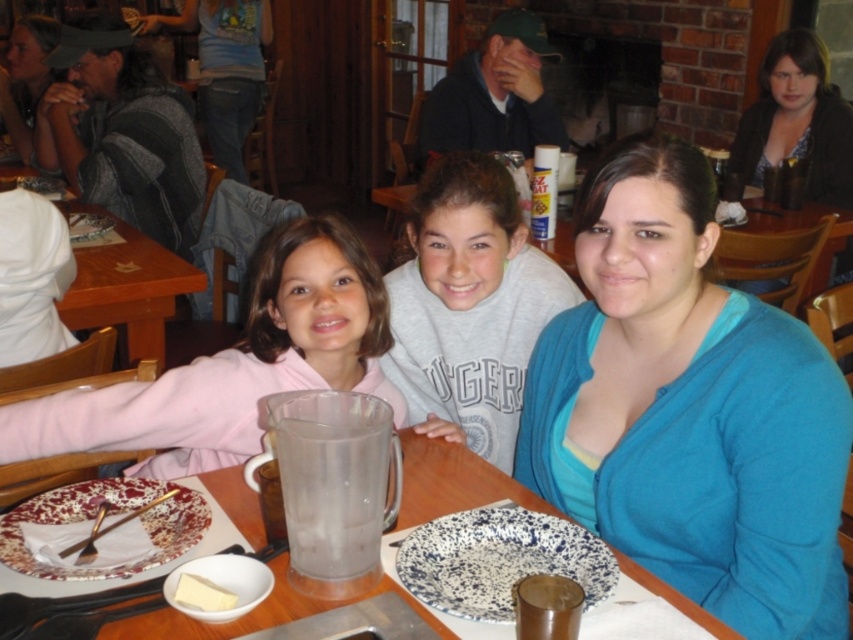
Consider the image. Can you confirm if matte black jacket at upper right is wider than matte black hat at upper left?

Incorrect, matte black jacket at upper right's width does not surpass matte black hat at upper left's.

Locate an element on the screen. matte black jacket at upper right is located at coordinates (798, 120).

The height and width of the screenshot is (640, 853). What are the coordinates of `matte black jacket at upper right` in the screenshot? It's located at (798, 120).

Who is positioned more to the left, blue cotton shirt at center or matte black jacket at upper right?

Positioned to the left is blue cotton shirt at center.

From the picture: Can you confirm if blue cotton shirt at center is positioned above matte black jacket at upper right?

No.

Where is `blue cotton shirt at center`? The width and height of the screenshot is (853, 640). blue cotton shirt at center is located at coordinates (688, 406).

Which is more to the right, speckled ceramic plate at lower center or matte black hat at upper left?

From the viewer's perspective, speckled ceramic plate at lower center appears more on the right side.

Is point (450, 518) behind point (10, 138)?

No, it is not.

You are a GUI agent. You are given a task and a screenshot of the screen. Output one action in this format:
    pyautogui.click(x=<x>, y=<y>)
    Task: Click on the speckled ceramic plate at lower center
    Image resolution: width=853 pixels, height=640 pixels.
    Given the screenshot: What is the action you would take?
    pyautogui.click(x=498, y=561)